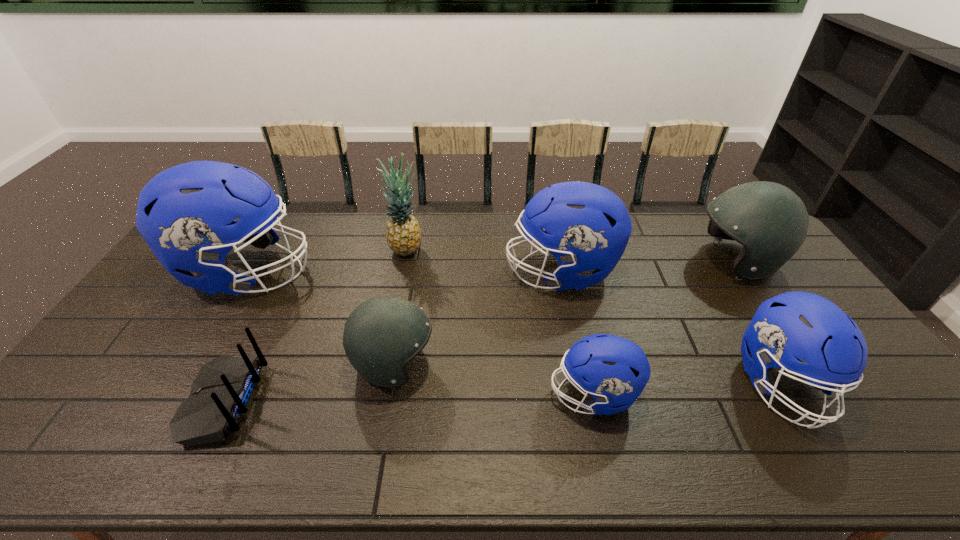
Locate an element on the screen. object at the far right corner is located at coordinates (771, 222).

The image size is (960, 540). What are the coordinates of `object situated at the near right corner` in the screenshot? It's located at (795, 325).

At what (x,y) coordinates should I click in order to perform the action: click on vacant space at the far edge of the desktop. Please return your answer as a coordinate pair (x, y). The image size is (960, 540). Looking at the image, I should click on (294, 251).

At what (x,y) coordinates should I click in order to perform the action: click on free spot at the near edge of the desktop. Please return your answer as a coordinate pair (x, y). Looking at the image, I should click on (341, 457).

The height and width of the screenshot is (540, 960). In the image, there is a desktop. In order to click on free space at the left edge in this screenshot , I will do `click(132, 323)`.

In the image, there is a desktop. In order to click on vacant area at the near left corner in this screenshot , I will do tap(24, 453).

Where is `free space between the smaller green football helmet and the second biggest blue football helmet`? The image size is (960, 540). free space between the smaller green football helmet and the second biggest blue football helmet is located at coordinates tap(477, 318).

Find the location of a particular element. The height and width of the screenshot is (540, 960). free spot between the black router and the rightmost blue football helmet is located at coordinates (503, 393).

Locate an element on the screen. Image resolution: width=960 pixels, height=540 pixels. free space between the smallest blue football helmet and the farther green football helmet is located at coordinates (664, 328).

Locate an element on the screen. This screenshot has width=960, height=540. vacant space that's between the smallest blue football helmet and the router is located at coordinates (409, 397).